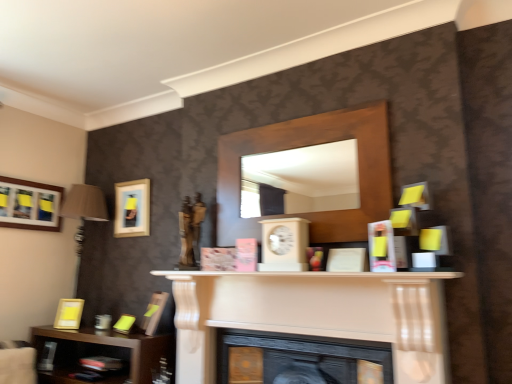
At what (x,y) coordinates should I click in order to perform the action: click on free space in front of matte yellow picture frame at lower left, which is counted as the 2th picture frame, starting from the left. Please return your answer as a coordinate pair (x, y). The height and width of the screenshot is (384, 512). Looking at the image, I should click on (65, 331).